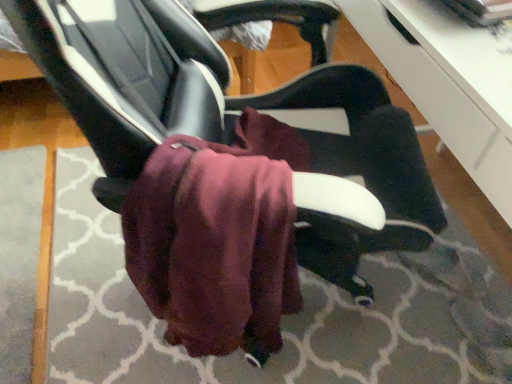
Question: Is burgundy fleece bath towel at center bigger or smaller than matte black chair at center?

Choices:
 (A) small
 (B) big

Answer: (A)

Question: Considering the positions of burgundy fleece bath towel at center and matte black chair at center in the image, is burgundy fleece bath towel at center taller or shorter than matte black chair at center?

Choices:
 (A) short
 (B) tall

Answer: (A)

Question: Estimate the real-world distances between objects in this image. Which object is closer to the matte black chair at center?

Choices:
 (A) burgundy fleece bath towel at center
 (B) maroon fabric at center

Answer: (A)

Question: Which object is positioned closest to the burgundy fleece bath towel at center?

Choices:
 (A) maroon fabric at center
 (B) matte black chair at center

Answer: (B)